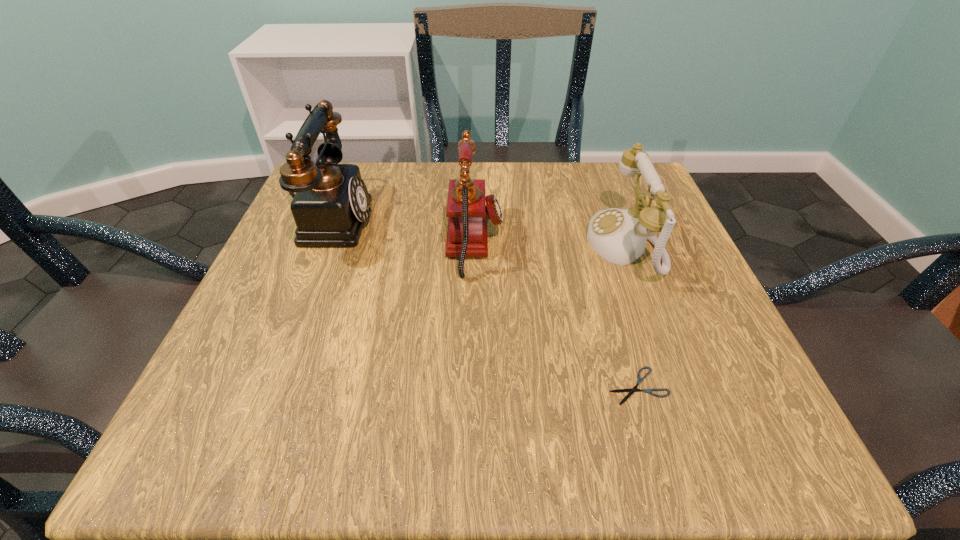
At what (x,y) coordinates should I click in order to perform the action: click on free area in between the nearest object and the tallest telephone. Please return your answer as a coordinate pair (x, y). This screenshot has width=960, height=540. Looking at the image, I should click on (484, 302).

Find the location of a particular element. This screenshot has width=960, height=540. vacant region between the second telephone from left to right and the shortest object is located at coordinates (556, 314).

The width and height of the screenshot is (960, 540). I want to click on free spot between the second telephone from left to right and the leftmost telephone, so click(402, 231).

Where is `object that stands as the third closest to the second telephone from left to right`? object that stands as the third closest to the second telephone from left to right is located at coordinates (639, 380).

Identify the location of object that is the nearest to the tallest telephone. (467, 236).

The image size is (960, 540). What are the coordinates of `telephone that stands as the closest to the tallest telephone` in the screenshot? It's located at (467, 236).

Identify which telephone is the nearest to the rightmost telephone. Please provide its 2D coordinates. Your answer should be formatted as a tuple, i.e. [(x, y)], where the tuple contains the x and y coordinates of a point satisfying the conditions above.

[(467, 236)]

This screenshot has width=960, height=540. In order to click on free point that satisfies the following two spatial constraints: 1. on the dial of the shortest object; 2. on the right side of the second telephone from left to right in this screenshot , I will do click(x=473, y=386).

This screenshot has height=540, width=960. What are the coordinates of `vacant region that satisfies the following two spatial constraints: 1. on the front of the tallest telephone at the rotary dial; 2. on the back side of the shears` in the screenshot? It's located at (261, 386).

This screenshot has width=960, height=540. Find the location of `vacant point that satisfies the following two spatial constraints: 1. on the back side of the shears; 2. on the front of the tallest object at the rotary dial`. vacant point that satisfies the following two spatial constraints: 1. on the back side of the shears; 2. on the front of the tallest object at the rotary dial is located at coordinates (588, 219).